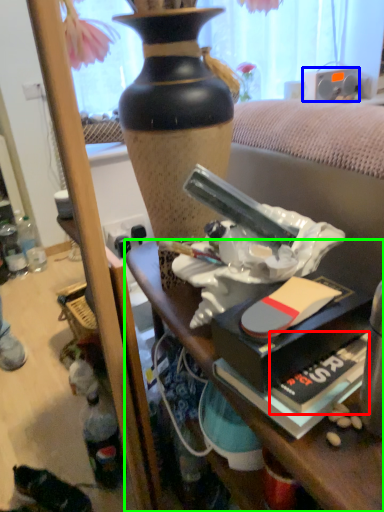
Question: Which object is positioned farthest from paperback book (highlighted by a red box)? Select from loudspeaker (highlighted by a blue box) and desk (highlighted by a green box).

Choices:
 (A) loudspeaker
 (B) desk

Answer: (A)